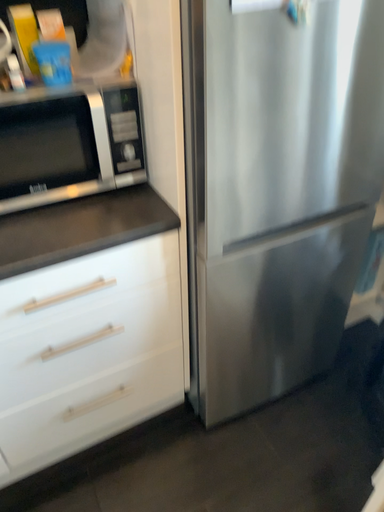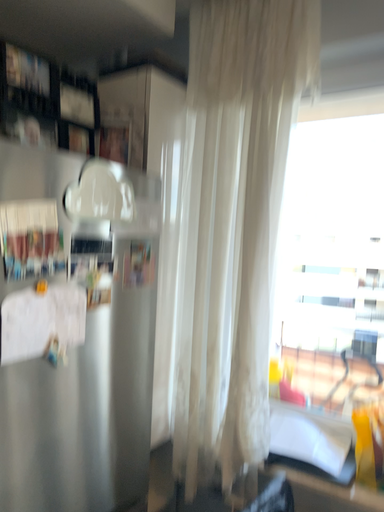
Question: How did the camera likely rotate when shooting the video?

Choices:
 (A) rotated right
 (B) rotated left

Answer: (A)